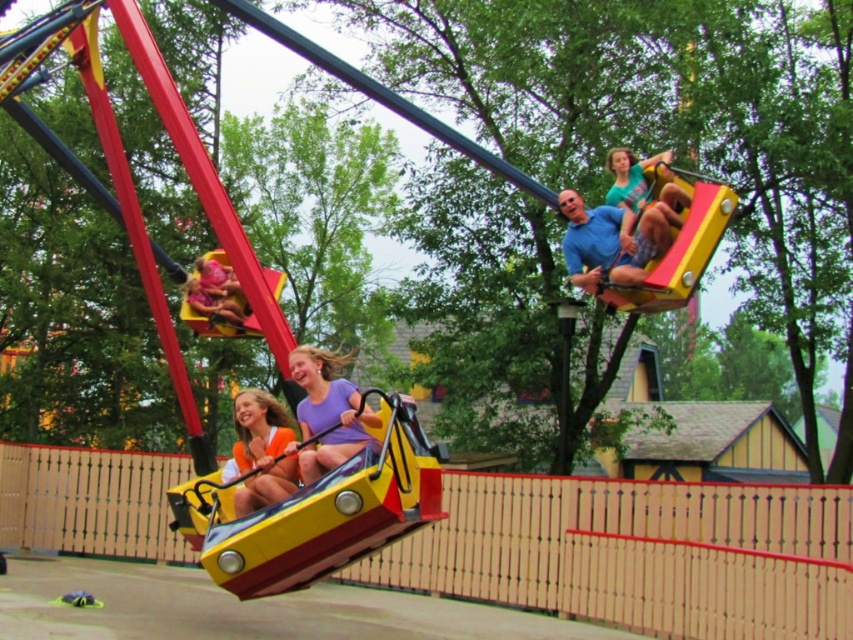
Question: Does orange fabric at lower center have a greater width compared to matte blue shirt at upper right?

Choices:
 (A) no
 (B) yes

Answer: (B)

Question: Which object appears farthest from the camera in this image?

Choices:
 (A) orange fabric at lower center
 (B) matte green shirt at upper right
 (C) purple matte shirt at center

Answer: (B)

Question: Which point appears closest to the camera in this image?

Choices:
 (A) (259, 436)
 (B) (358, 416)
 (C) (657, 244)
 (D) (639, 243)

Answer: (B)

Question: In this image, where is orange fabric at lower center located relative to matte green shirt at upper right?

Choices:
 (A) right
 (B) left

Answer: (B)

Question: Does purple matte shirt at center have a larger size compared to matte blue shirt at upper right?

Choices:
 (A) no
 (B) yes

Answer: (B)

Question: Which point appears farthest from the camera in this image?

Choices:
 (A) (277, 445)
 (B) (357, 417)

Answer: (A)